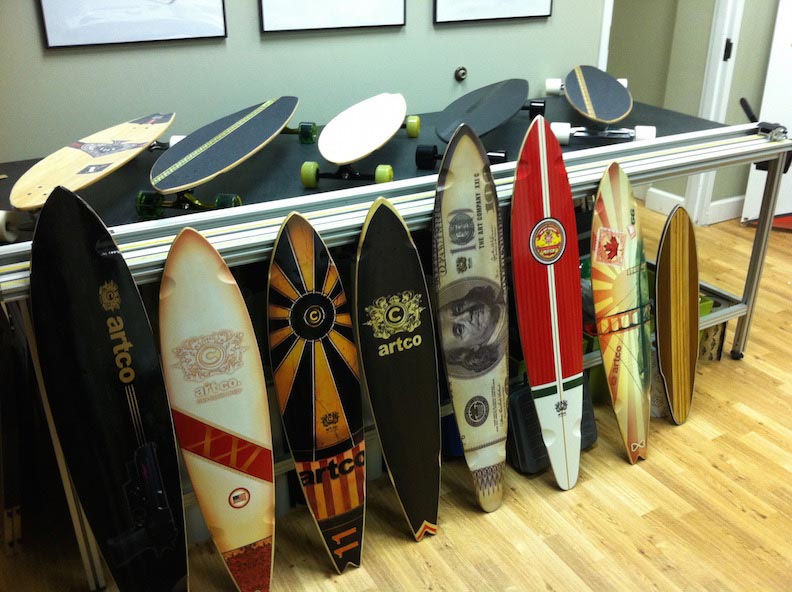
You are a GUI agent. You are given a task and a screenshot of the screen. Output one action in this format:
    pyautogui.click(x=<x>, y=<y>)
    Task: Click on the wood floor
    
    Given the screenshot: What is the action you would take?
    pyautogui.click(x=480, y=583), pyautogui.click(x=638, y=510), pyautogui.click(x=758, y=424), pyautogui.click(x=729, y=270)